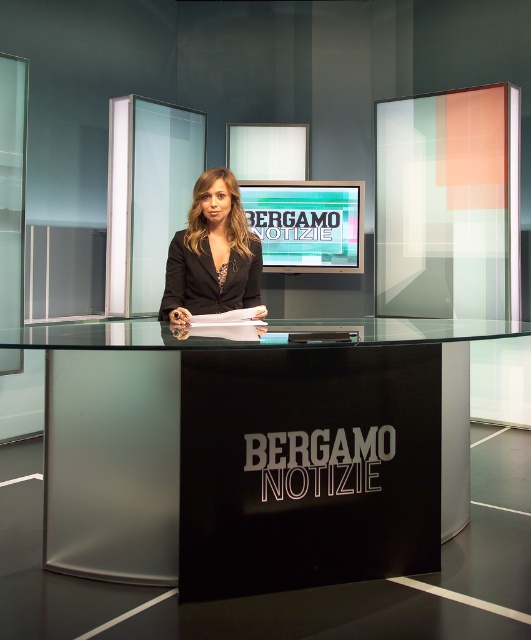
Is the position of transparent glass table at center more distant than that of matte black blazer at center?

No, it is in front of matte black blazer at center.

Does point (165, 568) come closer to viewer compared to point (207, 228)?

Yes, point (165, 568) is in front of point (207, 228).

Find the location of a particular element. The image size is (531, 640). transparent glass table at center is located at coordinates (253, 451).